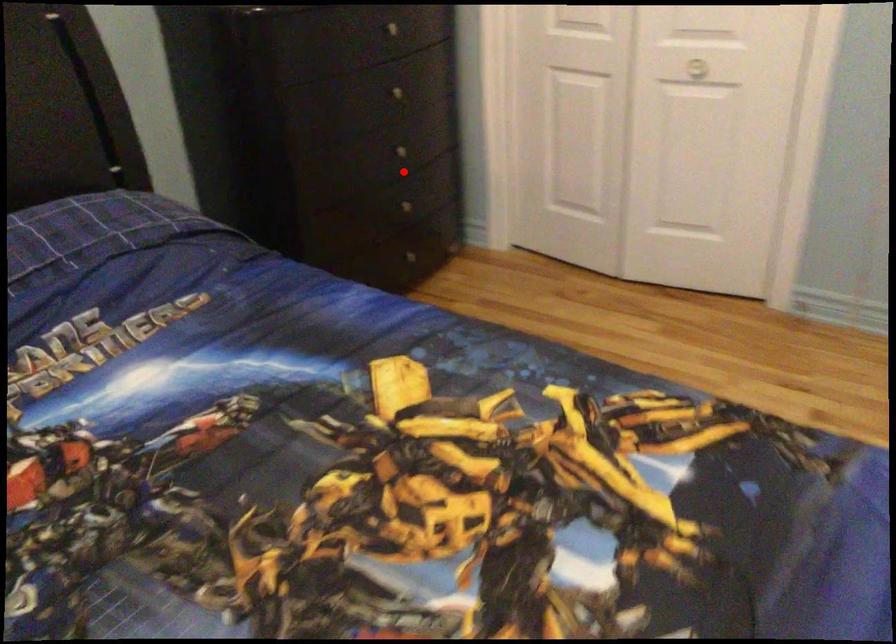
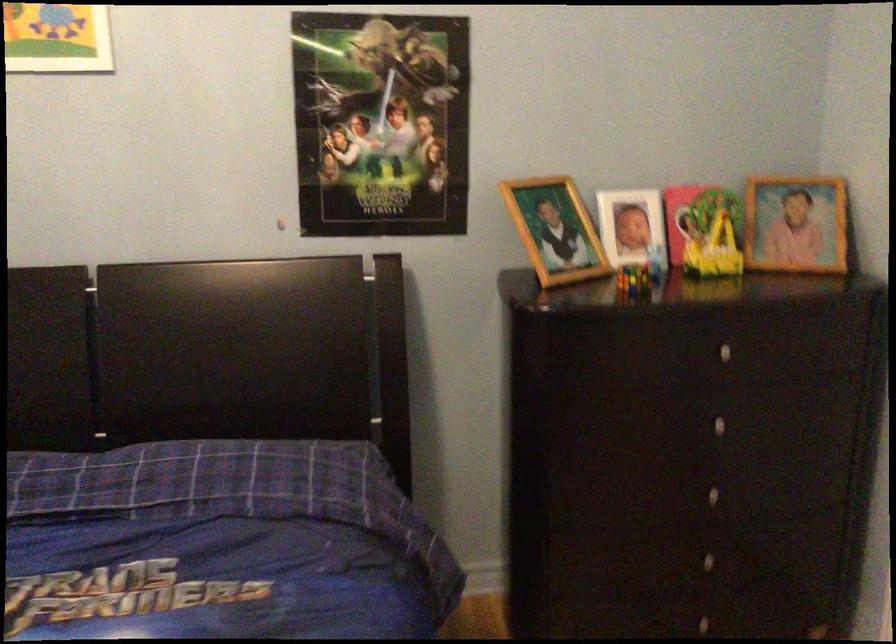
Question: I am providing you with two images of the same scene from different viewpoints. Image1 has a red point marked. In image2, the corresponding 3D location appears at what relative position? Reply with the corresponding letter.

Choices:
 (A) Closer
 (B) Farther

Answer: (A)